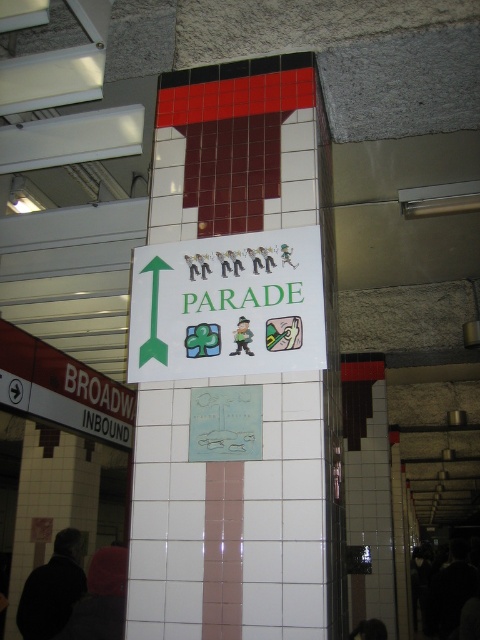
You are standing in the subway station and need to find the direction to the parade. You see the white tile pillar at center and the white plastic text at left. Which object is larger and might help you locate the sign indicating the parade direction?

The white tile pillar at center is bigger than the white plastic text at left, so it is the larger object and likely the one with the sign indicating the parade direction.

In the scene shown: You are standing at the subway station and want to determine which of the two points, point (300, 212) or point (245, 310), is closer to you. Based on the spatial arrangement shown in the image, which point is nearer?

Point (300, 212) is further to the viewer than point (245, 310), so the point closer to you is point (245, 310).

You are a subway passenger holding a 2.0 meter long poster. You need to walk between the white tile pillar at center and the sign attached to it. Can you pass through the space without tilting the poster?

The distance between the white tile pillar at center and the sign attached to it is 1.94 meters. Since your poster is 2.0 meters long, it is slightly longer than the available space. You would need to tilt the poster to pass through the narrow gap between them.